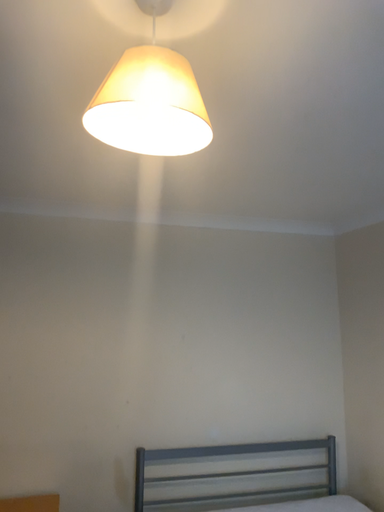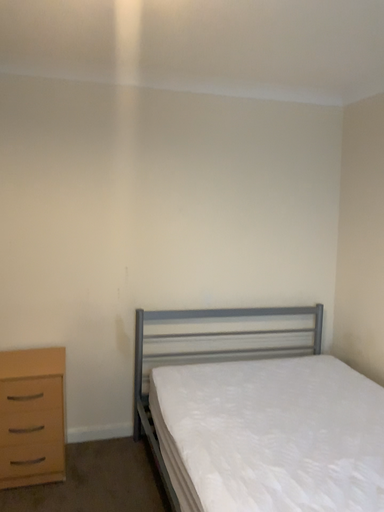
Question: How did the camera likely rotate when shooting the video?

Choices:
 (A) rotated upward
 (B) rotated downward

Answer: (B)